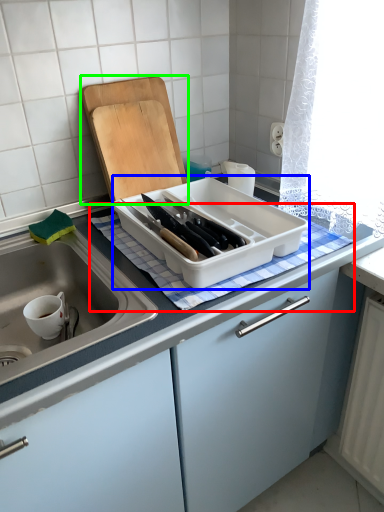
Question: Which is nearer to the tablecloth (highlighted by a red box)? kitchen appliance (highlighted by a blue box) or cutting board (highlighted by a green box).

Choices:
 (A) kitchen appliance
 (B) cutting board

Answer: (A)